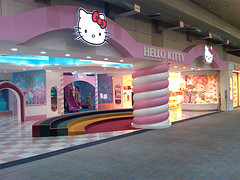
The height and width of the screenshot is (180, 240). In order to click on pink and white swirled column in this screenshot , I will do `click(156, 68)`, `click(155, 81)`.